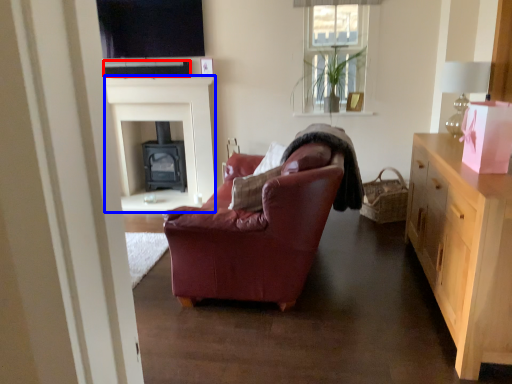
Question: Among these objects, which one is farthest to the camera, loudspeaker (highlighted by a red box) or fireplace (highlighted by a blue box)?

Choices:
 (A) loudspeaker
 (B) fireplace

Answer: (B)